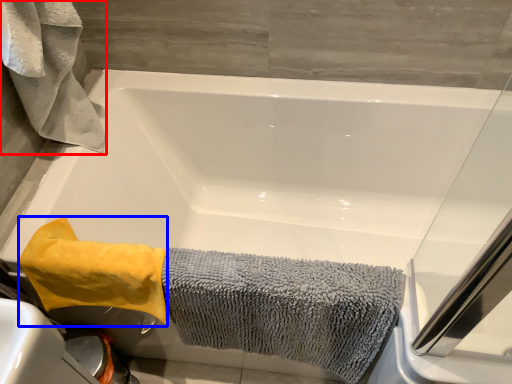
Question: Which object appears farthest to the camera in this image, bath towel (highlighted by a red box) or bath towel (highlighted by a blue box)?

Choices:
 (A) bath towel
 (B) bath towel

Answer: (B)